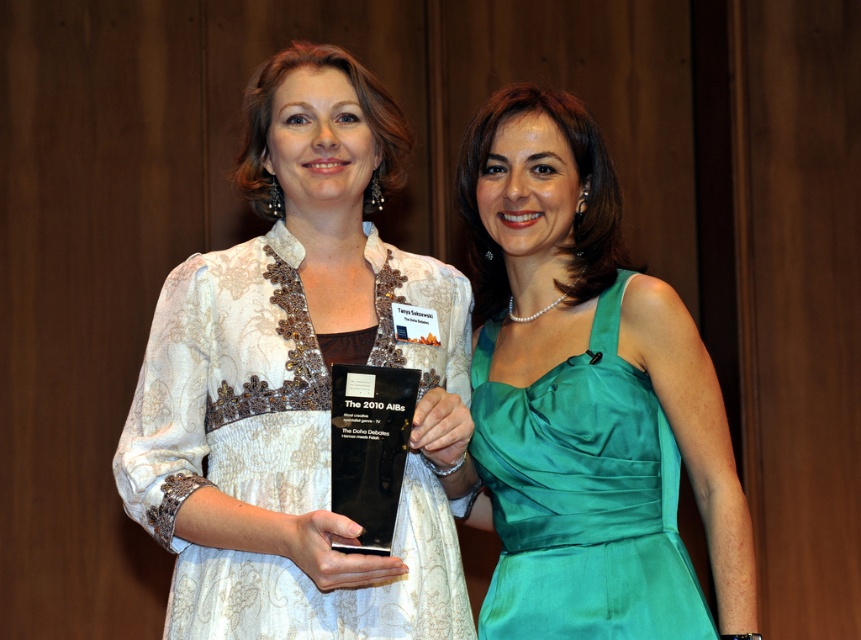
Question: Is white lace dress at center behind black glass award at center?

Choices:
 (A) no
 (B) yes

Answer: (A)

Question: Among these points, which one is farthest from the camera?

Choices:
 (A) (385, 273)
 (B) (391, 397)

Answer: (A)

Question: Which point is farther from the camera taking this photo?

Choices:
 (A) (319, 602)
 (B) (592, 588)
 (C) (373, 525)

Answer: (B)

Question: Does white lace dress at center appear over black glass award at center?

Choices:
 (A) yes
 (B) no

Answer: (A)

Question: In this image, where is emerald satin dress at right located relative to black glass award at center?

Choices:
 (A) below
 (B) above

Answer: (A)

Question: Which point appears farthest from the camera in this image?

Choices:
 (A) (413, 442)
 (B) (637, 468)
 (C) (376, 509)

Answer: (B)